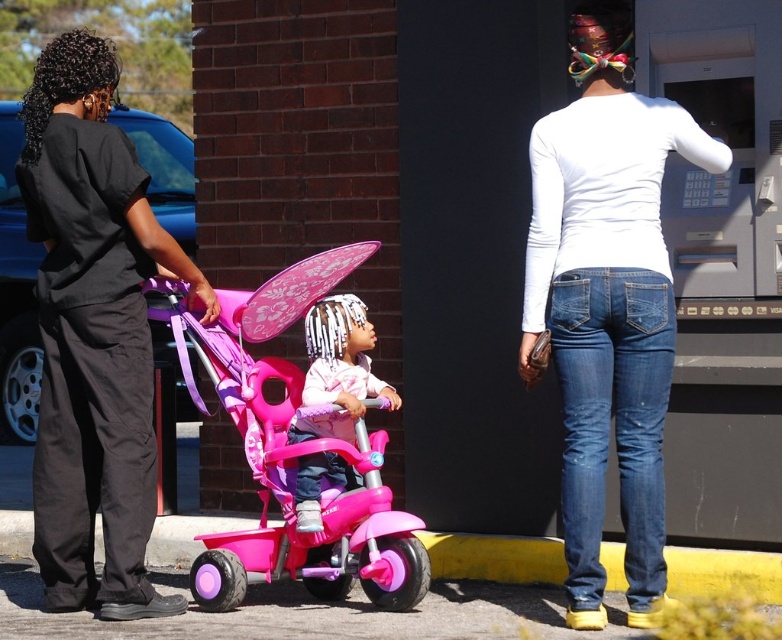
Looking at this image, does white matte shirt at center have a lesser height compared to black fabric shirt at left?

Yes, white matte shirt at center is shorter than black fabric shirt at left.

Who is more distant from viewer, [562,332] or [59,556]?

The point [59,556] is more distant.

Locate an element on the screen. This screenshot has width=782, height=640. white matte shirt at center is located at coordinates (607, 301).

Is point (142, 275) in front of point (321, 252)?

Yes, point (142, 275) is closer to viewer.

Who is positioned more to the right, black fabric shirt at left or pink plastic tricycle at center?

From the viewer's perspective, pink plastic tricycle at center appears more on the right side.

What do you see at coordinates (92, 333) in the screenshot? I see `black fabric shirt at left` at bounding box center [92, 333].

This screenshot has height=640, width=782. Find the location of `black fabric shirt at left`. black fabric shirt at left is located at coordinates (92, 333).

Is point (633, 492) positioned before point (339, 436)?

Yes, point (633, 492) is in front of point (339, 436).

Which is more to the left, white matte shirt at center or matte pink tricycle at center?

matte pink tricycle at center

Does point (630, 138) lie behind point (318, 340)?

No, it is in front of (318, 340).

You are a GUI agent. You are given a task and a screenshot of the screen. Output one action in this format:
    pyautogui.click(x=<x>, y=<y>)
    Task: Click on the white matte shirt at center
    The width and height of the screenshot is (782, 640).
    Given the screenshot: What is the action you would take?
    pyautogui.click(x=607, y=301)